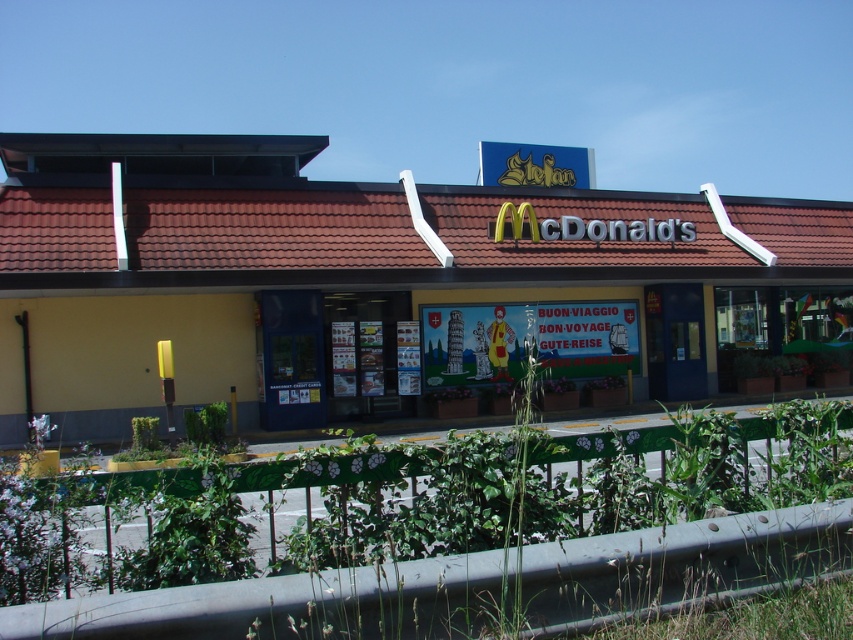
Can you confirm if yellow matte mcdonald's at center is wider than green leafy plant at lower center?

Indeed, yellow matte mcdonald's at center has a greater width compared to green leafy plant at lower center.

This screenshot has width=853, height=640. Identify the location of yellow matte mcdonald's at center. (366, 282).

The image size is (853, 640). Find the location of `yellow matte mcdonald's at center`. yellow matte mcdonald's at center is located at coordinates (366, 282).